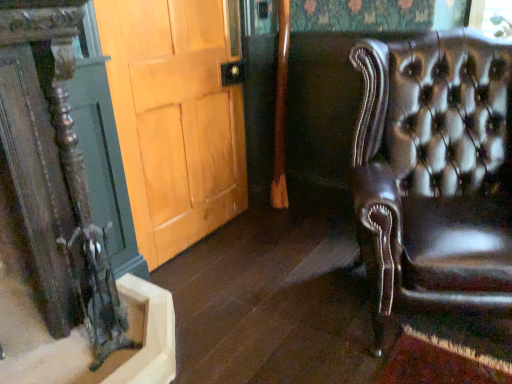
Where is `vacant space positioned to the left of brown leather chair at right`? The image size is (512, 384). vacant space positioned to the left of brown leather chair at right is located at coordinates (282, 317).